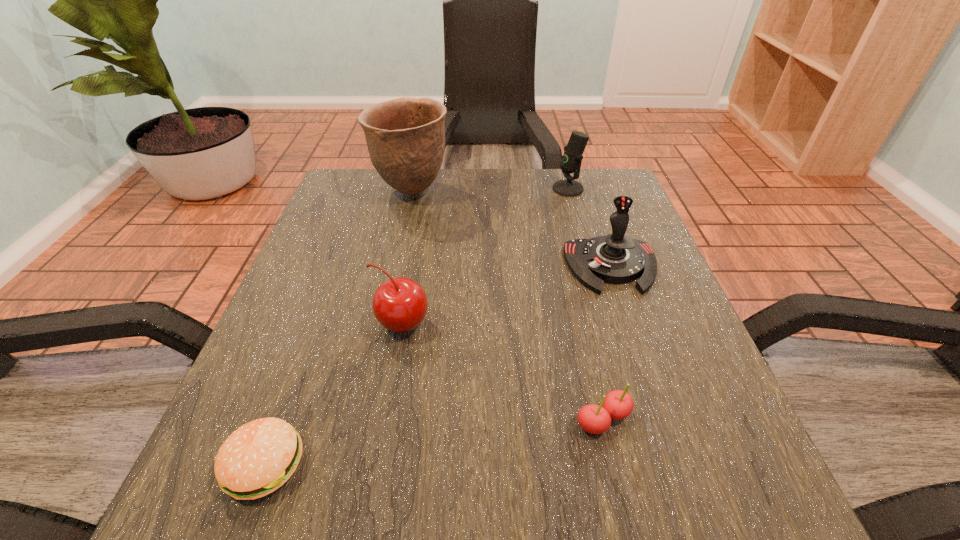
At what (x,y) coordinates should I click in order to perform the action: click on free spot located on the handle side of the joystick. Please return your answer as a coordinate pair (x, y). This screenshot has width=960, height=540. Looking at the image, I should click on (650, 379).

This screenshot has height=540, width=960. Find the location of `vacant area situated 0.240m on the right of the third nearest object`. vacant area situated 0.240m on the right of the third nearest object is located at coordinates (564, 325).

Identify the location of vacant space located on the right of the right cherry. The width and height of the screenshot is (960, 540). (686, 420).

At what (x,y) coordinates should I click in order to perform the action: click on vacant space situated 0.080m on the right of the shortest object. Please return your answer as a coordinate pair (x, y). Looking at the image, I should click on (363, 464).

The width and height of the screenshot is (960, 540). Find the location of `pottery present at the far edge`. pottery present at the far edge is located at coordinates coord(405,137).

Locate an element on the screen. microphone that is at the far edge is located at coordinates (571, 160).

The image size is (960, 540). I want to click on object positioned at the near edge, so click(259, 457).

You are a GUI agent. You are given a task and a screenshot of the screen. Output one action in this format:
    pyautogui.click(x=<x>, y=<y>)
    Task: Click on the pottery at the left edge
    
    Given the screenshot: What is the action you would take?
    tap(405, 137)

What are the coordinates of `patty situated at the left edge` in the screenshot? It's located at (259, 457).

This screenshot has width=960, height=540. What are the coordinates of `microphone at the right edge` in the screenshot? It's located at (571, 160).